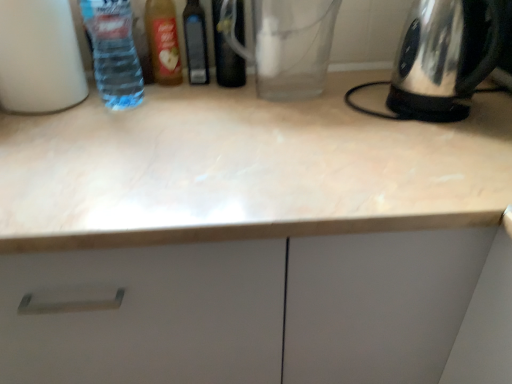
Question: Considering the relative sizes of translucent plastic bottle at upper left, which appears as the 4th bottle when viewed from the right, and transparent glass bottle at center, marked as the first bottle in a right-to-left arrangement, in the image provided, is translucent plastic bottle at upper left, which appears as the 4th bottle when viewed from the right, taller than transparent glass bottle at center, marked as the first bottle in a right-to-left arrangement,?

Choices:
 (A) no
 (B) yes

Answer: (B)

Question: Considering the relative positions of translucent plastic bottle at upper left, which appears as the 4th bottle when viewed from the right, and transparent glass bottle at center, marked as the first bottle in a right-to-left arrangement, in the image provided, is translucent plastic bottle at upper left, which appears as the 4th bottle when viewed from the right, to the right of transparent glass bottle at center, marked as the first bottle in a right-to-left arrangement, from the viewer's perspective?

Choices:
 (A) no
 (B) yes

Answer: (A)

Question: Does translucent plastic bottle at upper left, which appears as the 4th bottle when viewed from the right, lie behind transparent glass bottle at center, the fifth bottle when ordered from left to right?

Choices:
 (A) no
 (B) yes

Answer: (A)

Question: Does translucent plastic bottle at upper left, which appears as the 4th bottle when viewed from the right, turn towards transparent glass bottle at center, marked as the first bottle in a right-to-left arrangement?

Choices:
 (A) no
 (B) yes

Answer: (A)

Question: Considering the relative sizes of translucent plastic bottle at upper left, positioned as the 2th bottle in left-to-right order, and transparent glass bottle at center, the fifth bottle when ordered from left to right, in the image provided, is translucent plastic bottle at upper left, positioned as the 2th bottle in left-to-right order, bigger than transparent glass bottle at center, the fifth bottle when ordered from left to right,?

Choices:
 (A) no
 (B) yes

Answer: (B)

Question: In terms of width, does transparent glass bottle at center, marked as the first bottle in a right-to-left arrangement, look wider or thinner when compared to translucent glass bottle at center, the third bottle viewed from the right?

Choices:
 (A) thin
 (B) wide

Answer: (B)

Question: In terms of height, does transparent glass bottle at center, the fifth bottle when ordered from left to right, look taller or shorter compared to translucent glass bottle at center, the third bottle viewed from the right?

Choices:
 (A) short
 (B) tall

Answer: (B)

Question: Considering their positions, is transparent glass bottle at center, the fifth bottle when ordered from left to right, located in front of or behind translucent glass bottle at center, the third bottle viewed from the right?

Choices:
 (A) behind
 (B) front

Answer: (B)

Question: Considering the positions of transparent glass bottle at center, the fifth bottle when ordered from left to right, and translucent glass bottle at center, which ranks as the third bottle in left-to-right order, in the image, is transparent glass bottle at center, the fifth bottle when ordered from left to right, bigger or smaller than translucent glass bottle at center, which ranks as the third bottle in left-to-right order,?

Choices:
 (A) big
 (B) small

Answer: (A)

Question: In the image, is transparent glass bottle at center, the fifth bottle when ordered from left to right, positioned in front of or behind transparent glass coffee pot at center?

Choices:
 (A) behind
 (B) front

Answer: (A)

Question: Considering the positions of transparent glass bottle at center, the fifth bottle when ordered from left to right, and transparent glass coffee pot at center in the image, is transparent glass bottle at center, the fifth bottle when ordered from left to right, wider or thinner than transparent glass coffee pot at center?

Choices:
 (A) wide
 (B) thin

Answer: (A)

Question: From a real-world perspective, is transparent glass bottle at center, the fifth bottle when ordered from left to right, above or below transparent glass coffee pot at center?

Choices:
 (A) above
 (B) below

Answer: (A)

Question: Which is correct: transparent glass bottle at center, the fifth bottle when ordered from left to right, is inside transparent glass coffee pot at center, or outside of it?

Choices:
 (A) inside
 (B) outside

Answer: (B)

Question: In the image, is transparent glass bottle at center, the fifth bottle when ordered from left to right, on the left side or the right side of white matte bottle at left, the 5th bottle positioned from the right?

Choices:
 (A) left
 (B) right

Answer: (B)

Question: Considering their positions, is transparent glass bottle at center, the fifth bottle when ordered from left to right, located in front of or behind white matte bottle at left, the 1th bottle viewed from the left?

Choices:
 (A) behind
 (B) front

Answer: (A)